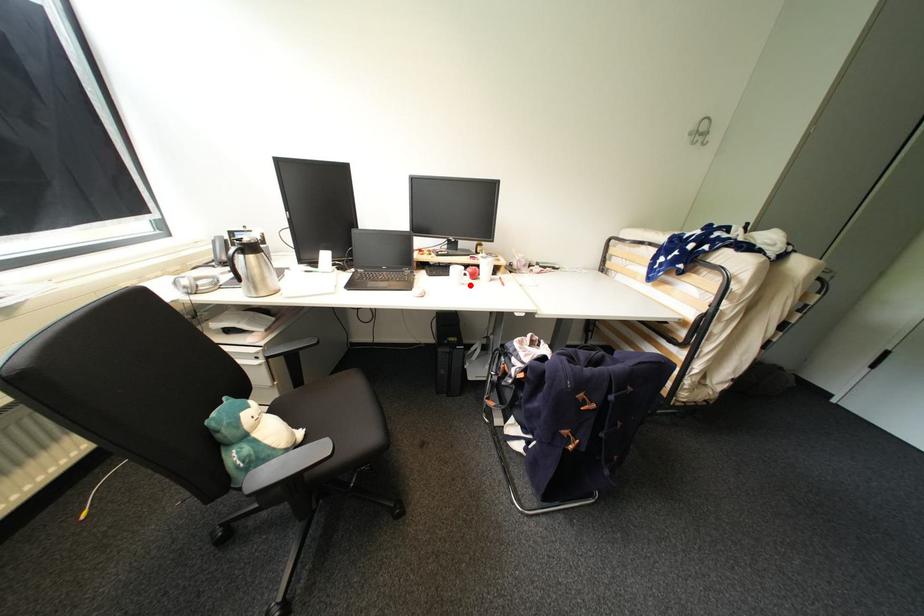
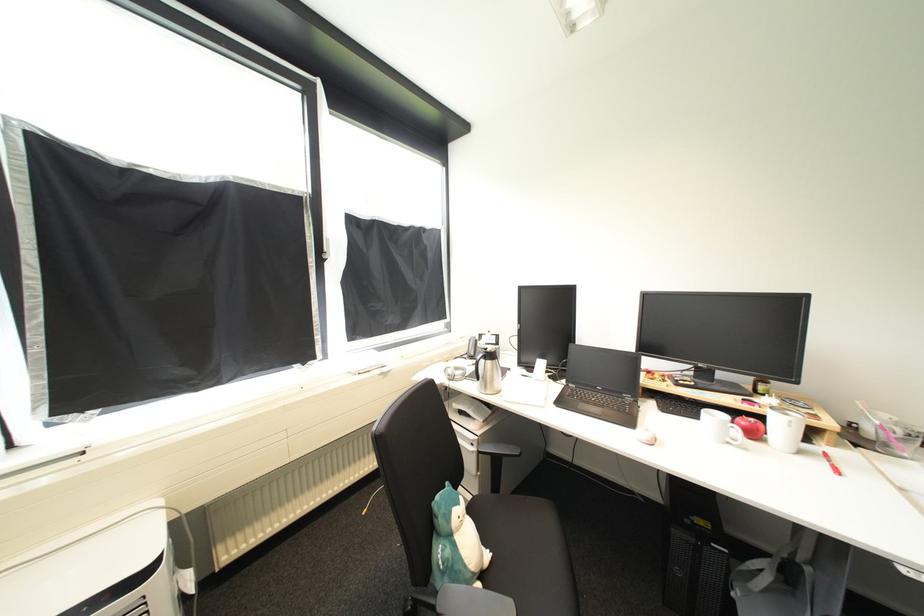
The point at the highlighted location is marked in the first image. Where is the corresponding point in the second image?

(736, 445)